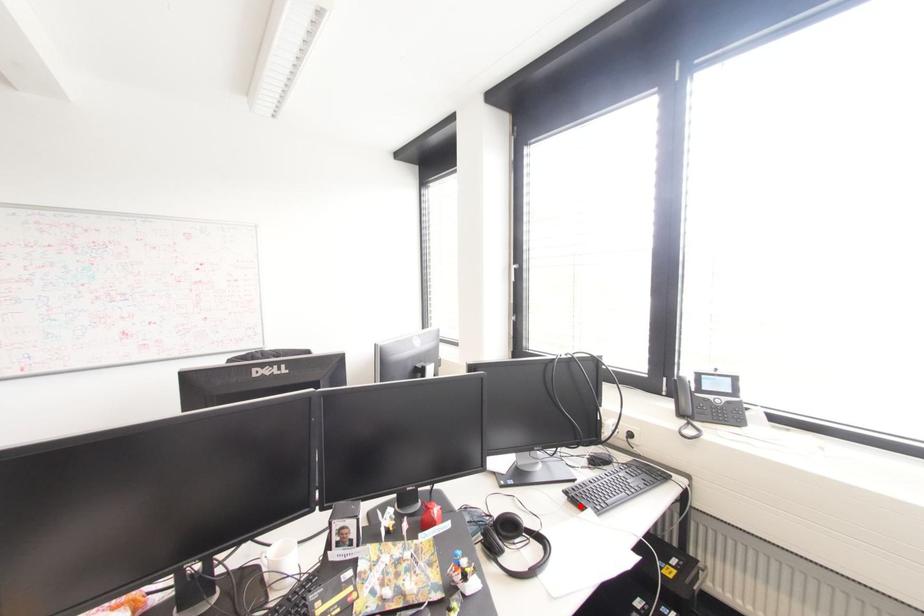
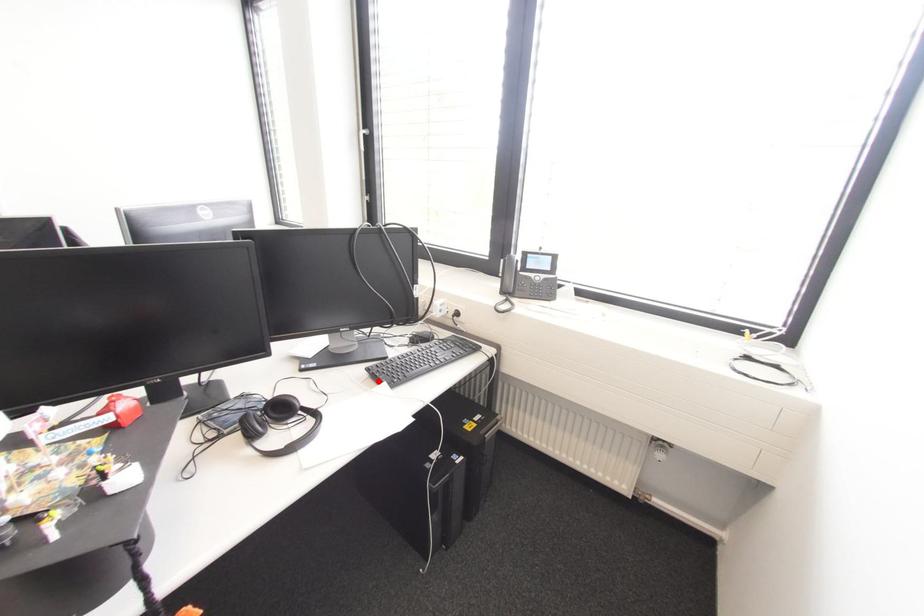
I am providing you with two images of the same scene from different viewpoints. A red point is marked on the first image and another point is marked on the second image. Do the highlighted points in image1 and image2 indicate the same real-world spot?

Yes